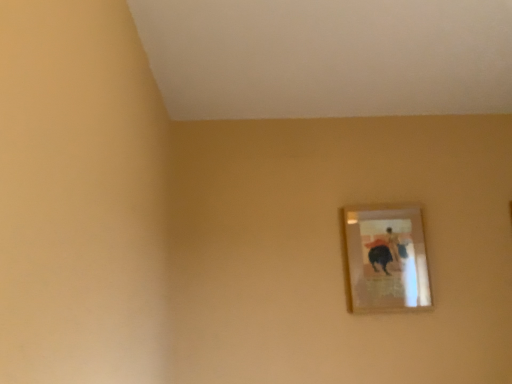
What do you see at coordinates (386, 258) in the screenshot? The width and height of the screenshot is (512, 384). I see `wooden picture frame at center` at bounding box center [386, 258].

The height and width of the screenshot is (384, 512). In order to click on wooden picture frame at center in this screenshot , I will do coord(386,258).

Measure the distance between point (392,261) and camera.

Point (392,261) is 7.21 feet from camera.

Identify the location of wooden picture frame at center. (386, 258).